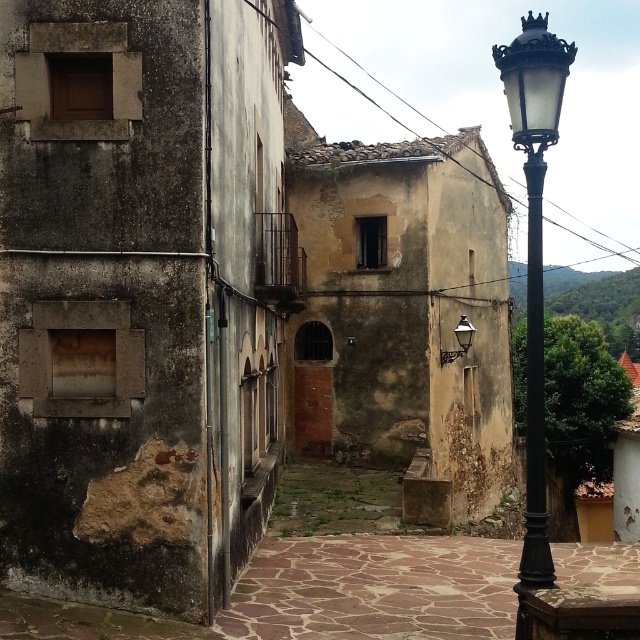
Is black metal street light at upper right taller than matte black lamp at upper right?

Indeed, black metal street light at upper right has a greater height compared to matte black lamp at upper right.

This screenshot has width=640, height=640. What do you see at coordinates (532, 262) in the screenshot? I see `black metal street light at upper right` at bounding box center [532, 262].

Find the location of a particular element. This screenshot has height=640, width=640. black metal street light at upper right is located at coordinates (532, 262).